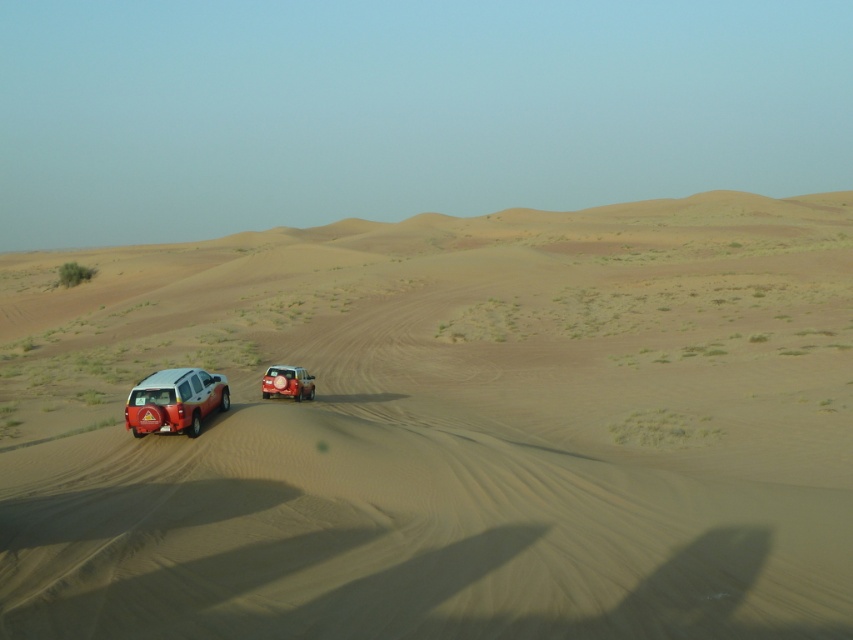
Question: Which point is farther from the camera taking this photo?

Choices:
 (A) (166, 396)
 (B) (311, 397)
 (C) (821, 323)

Answer: (C)

Question: Can you confirm if matte white suv at lower left is smaller than metallic silver suv at center?

Choices:
 (A) yes
 (B) no

Answer: (A)

Question: Does sandy beige dunes at center appear on the right side of metallic silver suv at center?

Choices:
 (A) no
 (B) yes

Answer: (A)

Question: Which point is closer to the camera taking this photo?

Choices:
 (A) (277, 388)
 (B) (523, 458)

Answer: (B)

Question: Can you confirm if sandy beige dunes at center is smaller than matte white suv at lower left?

Choices:
 (A) yes
 (B) no

Answer: (B)

Question: Which object appears farthest from the camera in this image?

Choices:
 (A) matte white suv at lower left
 (B) sandy beige dunes at center

Answer: (A)